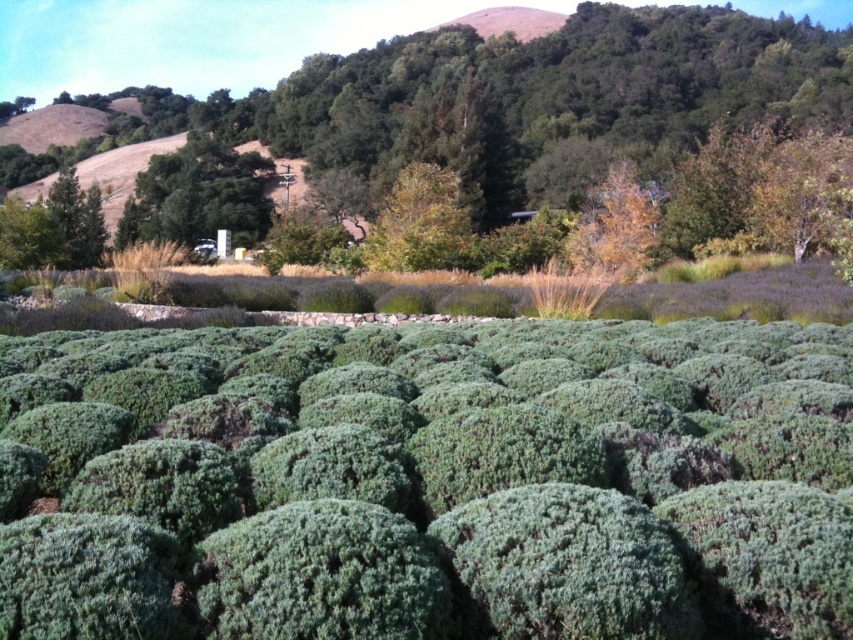
You are standing in the garden and see a point marked at coordinates (532, 99). Which object in the scene does this point correspond to?

The point at coordinates (532, 99) is on the green leafy tree at center.

From the picture: You are planning to plant a new tree in your garden. You have two options based on the image provided. The first option is the green leafy tree at center, and the second is the green leafy tree at upper center. If you want a wider tree for shade, which one should you choose?

The green leafy tree at center has a larger width than the green leafy tree at upper center, so it would be the better choice for a wider tree providing more shade.